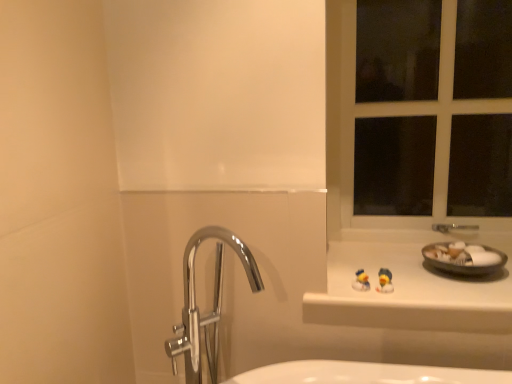
Locate an element on the screen. free spot below matte gray bowl at right (from a real-world perspective) is located at coordinates (470, 283).